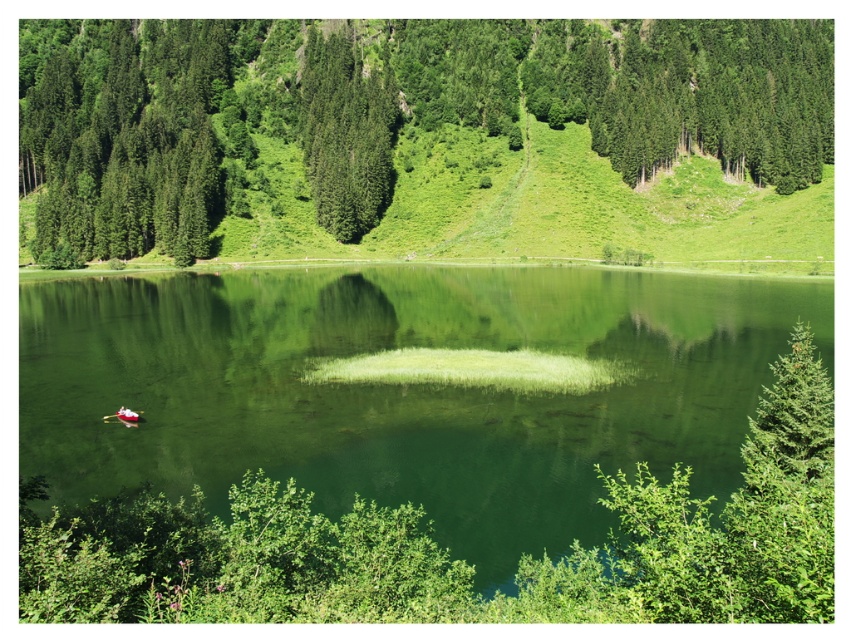
You are standing at the edge of the lake and notice the green smooth water at center and the green matte tree at center. Which object is closer to the water surface?

The green smooth water at center is located below the green matte tree at center, so the green smooth tree is closer to the water surface.

You are standing at the edge of the lake and want to take a photo of the green matte tree at center. Based on its position, which direction should you face to ensure the tree is in the center of your camera frame?

The green matte tree at center is located at point coordinates, so you should face directly towards the center of the lake to capture it in the center of your camera frame.

You are standing at the lakeside and want to take a photo of both the green smooth water at center and the green textured tree at upper center. Which object will appear larger in your photo?

The green smooth water at center will appear larger in the photo because it is closer to the viewer than the green textured tree at upper center.